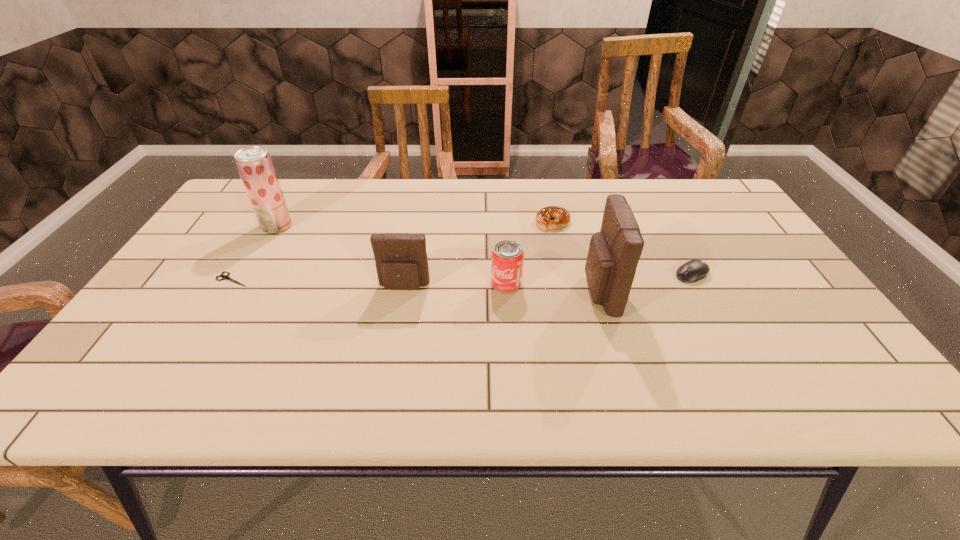
Please point a vacant point for placing a pouch on the right. Please provide its 2D coordinates. Your answer should be formatted as a tuple, i.e. [(x, y)], where the tuple contains the x and y coordinates of a point satisfying the conditions above.

[(799, 297)]